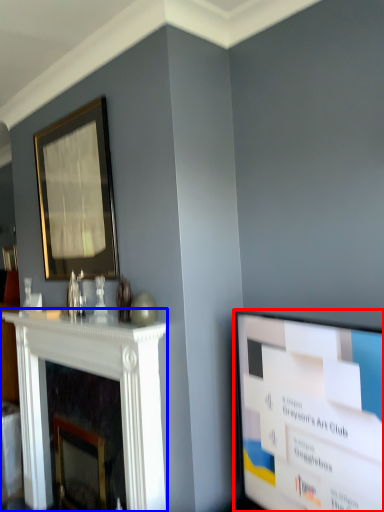
Question: Among these objects, which one is farthest to the camera, television (highlighted by a red box) or fireplace (highlighted by a blue box)?

Choices:
 (A) television
 (B) fireplace

Answer: (B)